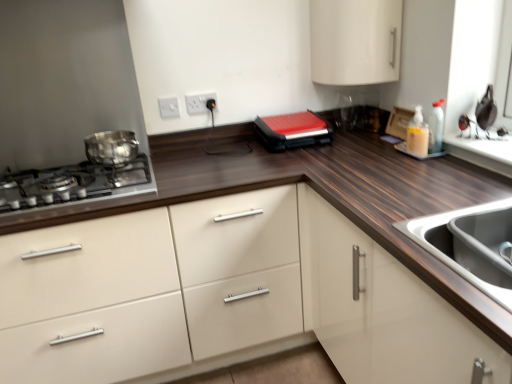
Identify the location of free spot above shiny metallic pot at left (from a real-world perspective). The image size is (512, 384). (103, 136).